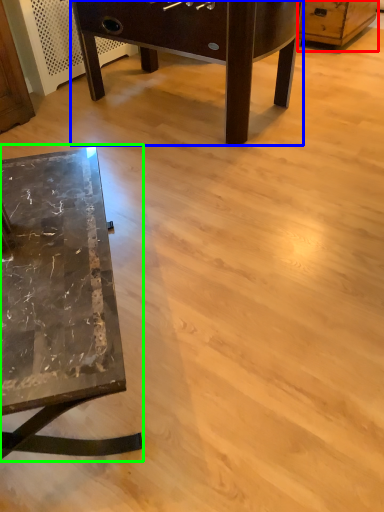
Question: Which object is positioned closest to dresser (highlighted by a red box)? Select from table (highlighted by a blue box) and table (highlighted by a green box).

Choices:
 (A) table
 (B) table

Answer: (A)